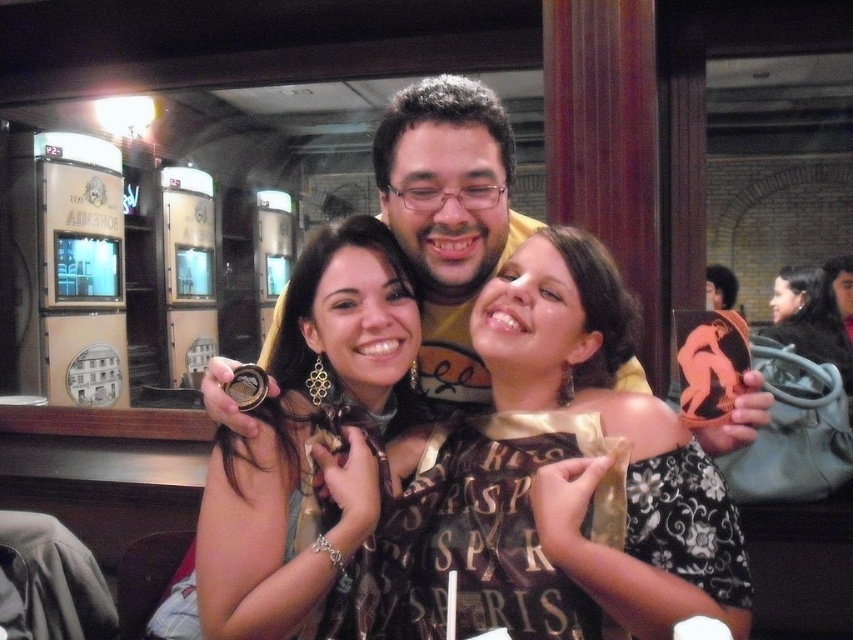
Question: Is matte gold coin at center further to the viewer compared to matte black purse at upper right?

Choices:
 (A) no
 (B) yes

Answer: (A)

Question: Which of the following is the closest to the observer?

Choices:
 (A) (838, 340)
 (B) (558, 340)
 (C) (410, 323)
 (D) (457, 268)

Answer: (B)

Question: Which point is closer to the camera taking this photo?

Choices:
 (A) (405, 273)
 (B) (468, 490)

Answer: (B)

Question: Is gold chain necklace at center smaller than matte black purse at upper right?

Choices:
 (A) no
 (B) yes

Answer: (B)

Question: Is shiny gold necklace at center to the left of gold chain necklace at center from the viewer's perspective?

Choices:
 (A) yes
 (B) no

Answer: (B)

Question: Estimate the real-world distances between objects in this image. Which object is farther from the shiny gold necklace at center?

Choices:
 (A) matte black purse at upper right
 (B) gold chain necklace at center
 (C) matte gold coin at center

Answer: (A)